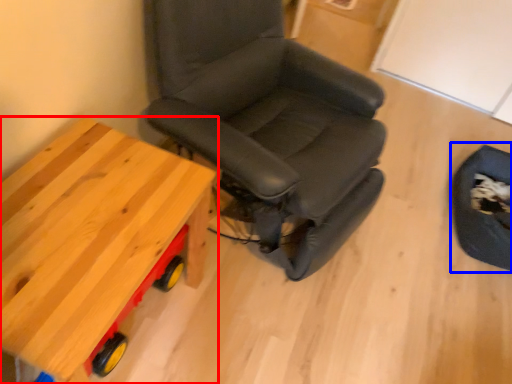
Question: Which of the following is the closest to the observer, table (highlighted by a red box) or swivel chair (highlighted by a blue box)?

Choices:
 (A) table
 (B) swivel chair

Answer: (A)